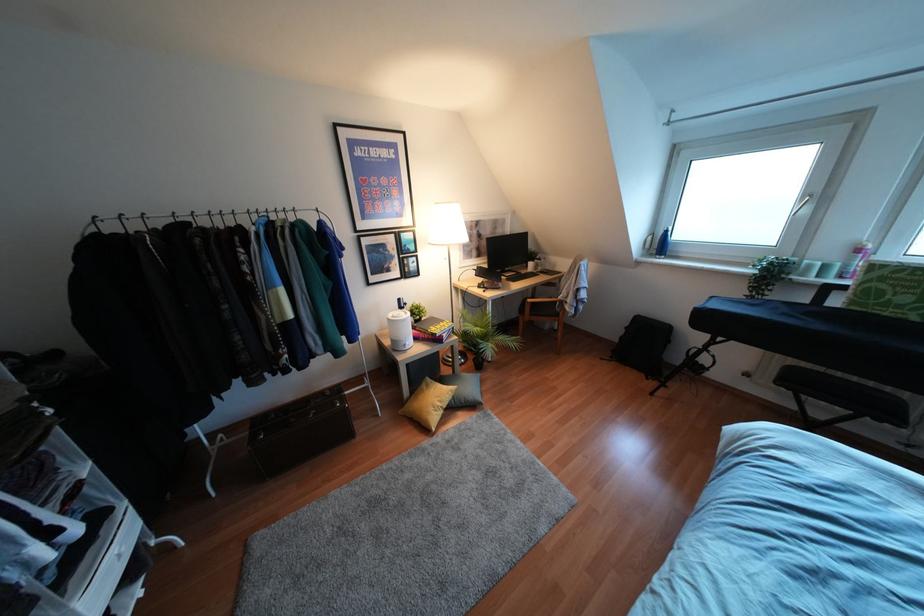
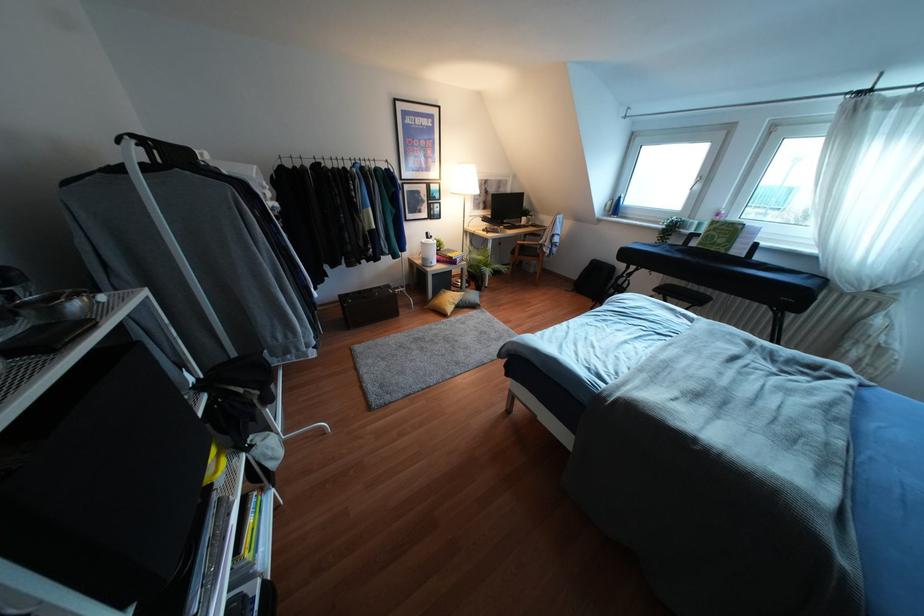
Locate, in the second image, the point that corresponds to point 881,292 in the first image.

(712, 236)